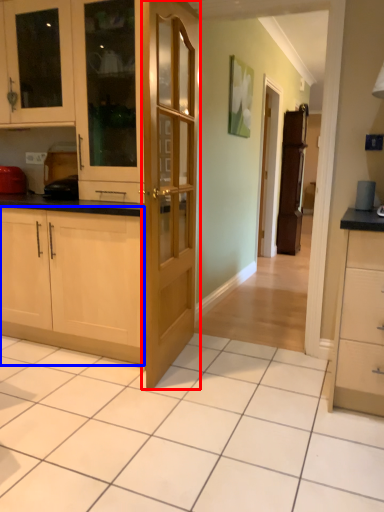
Question: Among these objects, which one is nearest to the camera, door (highlighted by a red box) or cabinetry (highlighted by a blue box)?

Choices:
 (A) door
 (B) cabinetry

Answer: (A)